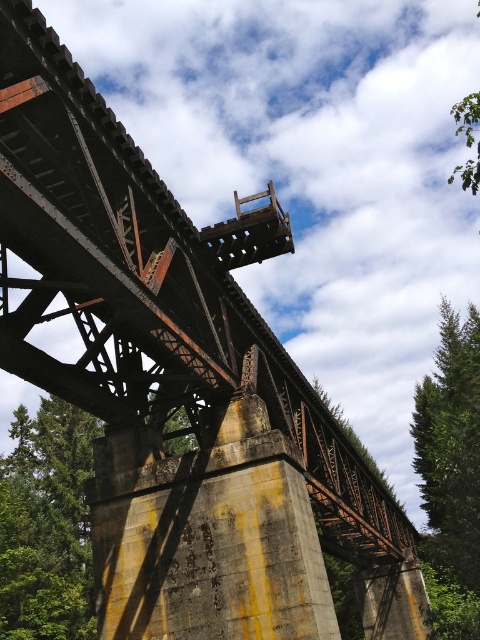
Question: Does green leafy tree at lower left have a greater width compared to green textured tree at right?

Choices:
 (A) yes
 (B) no

Answer: (A)

Question: Is green leafy tree at lower left wider than green textured tree at right?

Choices:
 (A) yes
 (B) no

Answer: (A)

Question: Can you confirm if green leafy tree at lower left is bigger than green textured tree at right?

Choices:
 (A) no
 (B) yes

Answer: (A)